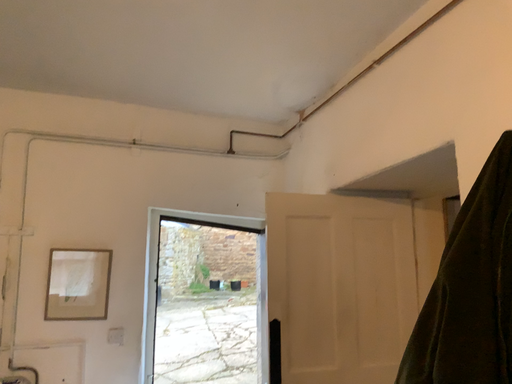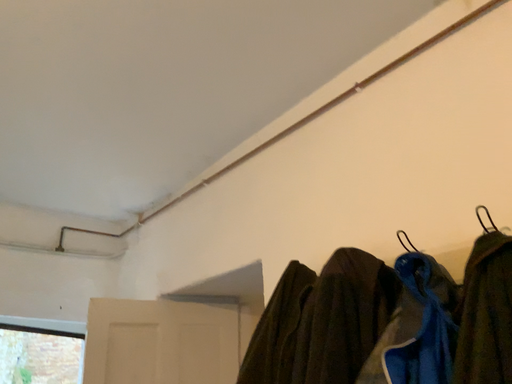
Question: Which way did the camera rotate in the video?

Choices:
 (A) rotated right
 (B) rotated left

Answer: (A)